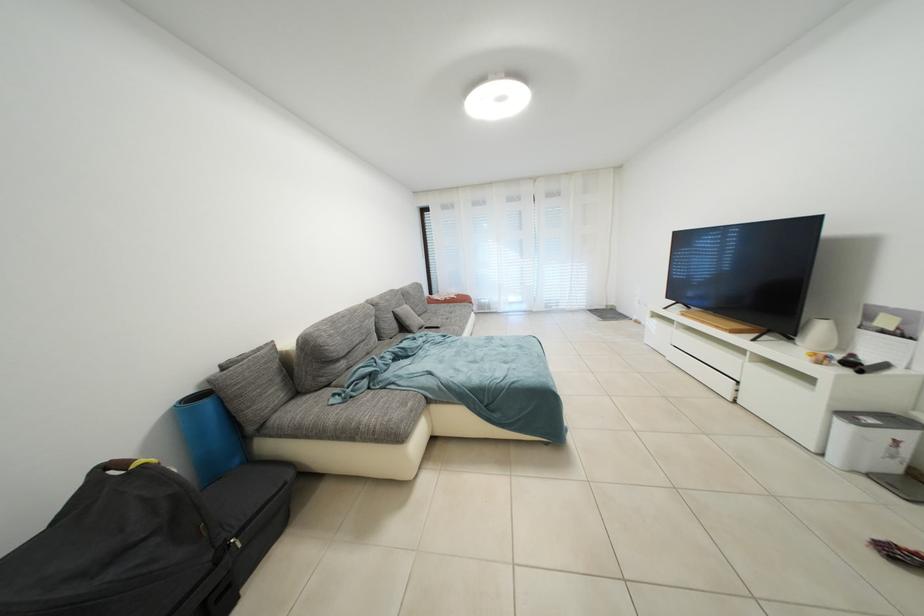
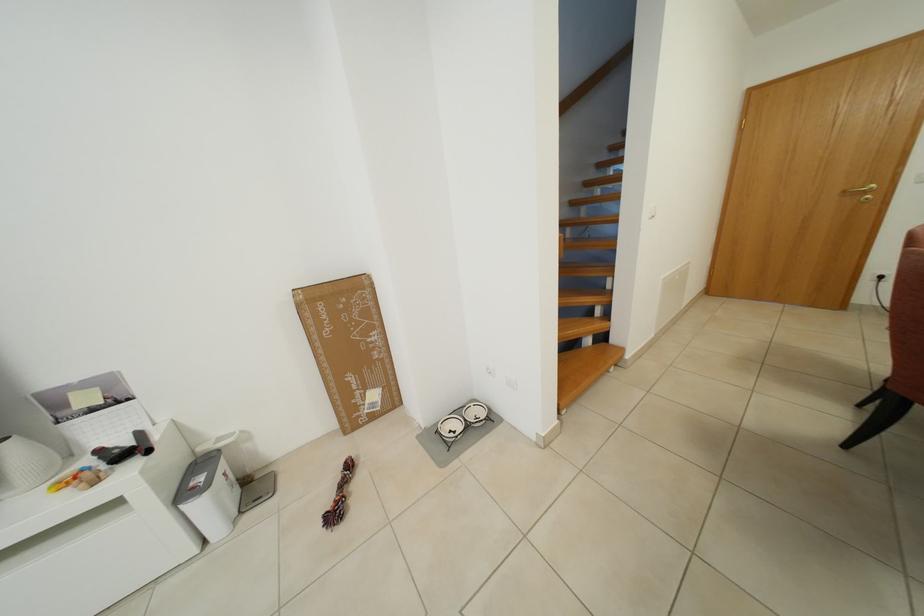
In the second image, find the point that corresponds to point (829, 334) in the first image.

(21, 460)